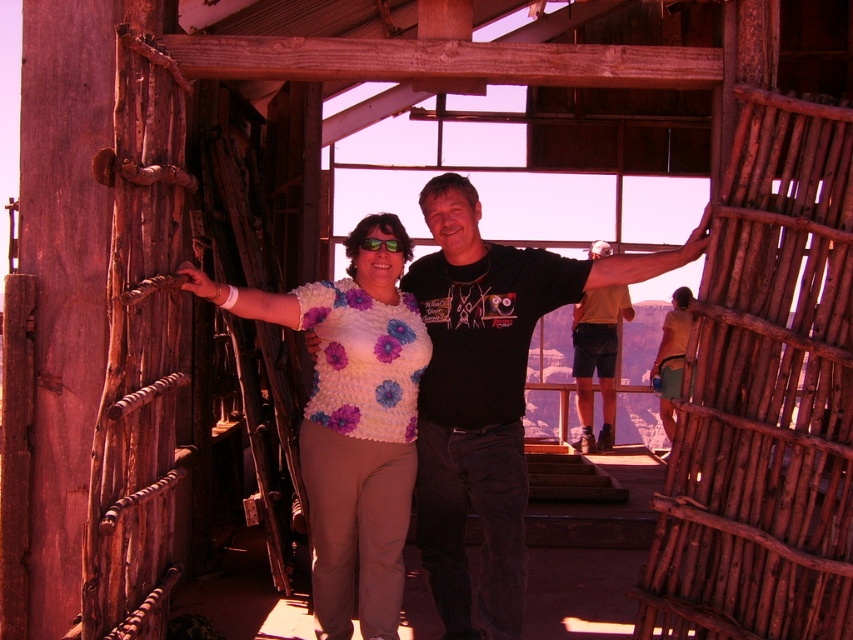
You are standing at the point marked as point (245, 300) in the image. Looking around, you see a rustic wooden structure with two people. The person on the left is wearing a white top with purple and blue flowers. Can you tell me what is located directly below this point?

The point (245, 300) is on white fabric at center, so the white fabric at center is directly below the point.

You are a photographer trying to capture a clear shot of the black matte arm at upper right without the white fabric at center blocking it. Based on the scene description, is this possible?

The white fabric at center is in front of the black matte arm at upper right, so it is blocking the view. To capture a clear shot of the black matte arm at upper right, you would need to adjust your position or angle to avoid the white fabric at center.

You are a photographer planning to take a photo of the scene. The white fabric at center and the black matte arm at upper right are both in your frame. Based on their heights, which object should you adjust your camera angle to focus on first to ensure both are in the frame?

Since the white fabric at center is taller than the black matte arm at upper right, you should adjust your camera angle to focus on the white fabric at center first to ensure both are in the frame.